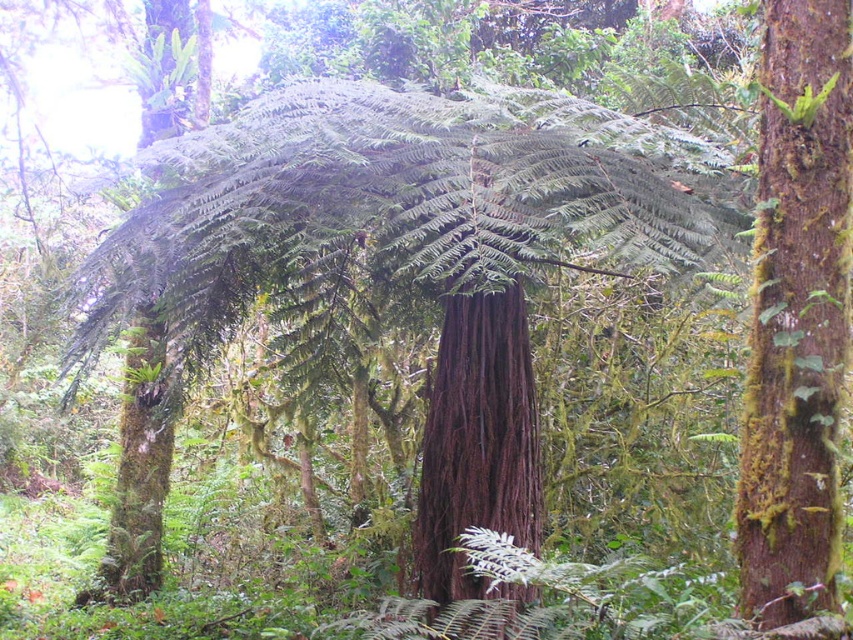
You are a hiker in the forest and want to climb the tallest object between the brown rough bark at right and the dark brown wood at center. Which one should you choose?

The brown rough bark at right has a greater height compared to the dark brown wood at center, so you should choose the brown rough bark at right to climb.

You are a hiker trying to navigate through the forest. You see the brown rough bark at right and the dark brown wood at center. How far apart are these two landmarks?

The brown rough bark at right and the dark brown wood at center are 5.48 feet apart from each other.

You are a hiker who has stumbled upon this forest scene. You notice the brown rough bark at right and the dark brown wood at center. Which object is positioned higher in the scene?

The brown rough bark at right is positioned higher than the dark brown wood at center because it is located above it.